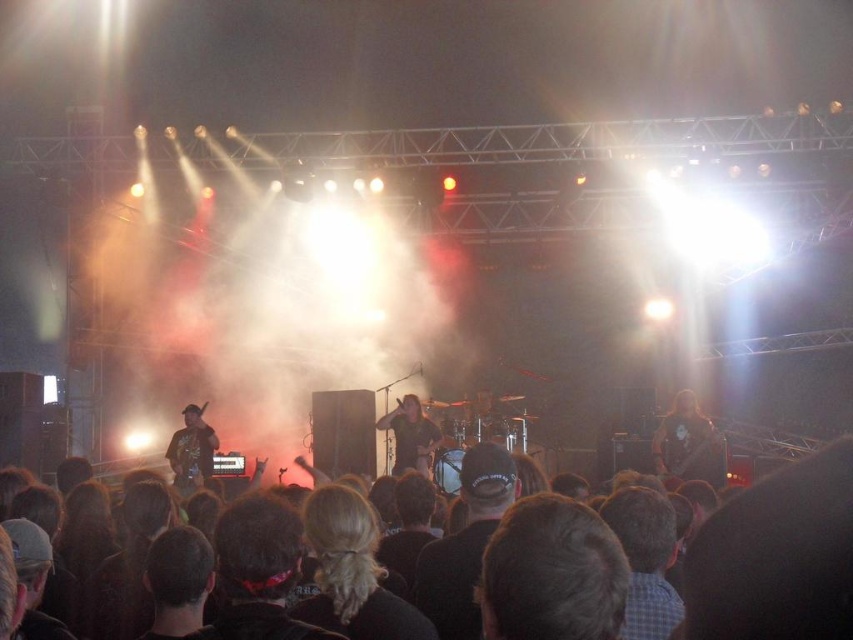
Between dark brown hair at center and shiny black guitar at center, which one has more height?

Standing taller between the two is shiny black guitar at center.

Who is more forward, (543,636) or (399,429)?

Positioned in front is point (543,636).

Locate an element on the screen. The height and width of the screenshot is (640, 853). dark brown hair at center is located at coordinates (552, 573).

Between dark brown hair at center and green fabric guitar at left, which one appears on the left side from the viewer's perspective?

From the viewer's perspective, green fabric guitar at left appears more on the left side.

Who is taller, dark brown hair at center or green fabric guitar at left?

green fabric guitar at left

Locate an element on the screen. Image resolution: width=853 pixels, height=640 pixels. dark brown hair at center is located at coordinates tap(552, 573).

The image size is (853, 640). Find the location of `dark brown hair at center`. dark brown hair at center is located at coordinates tap(552, 573).

Is dark brown hair at center positioned in front of dark brown leather guitar at center?

That is True.

Which is in front, point (561, 566) or point (666, 476)?

Point (561, 566) is in front.

I want to click on dark brown hair at center, so [x=552, y=573].